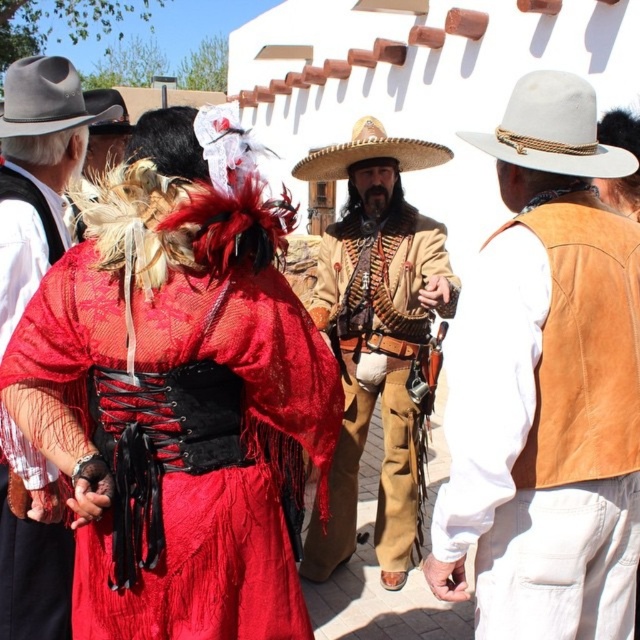
Is brown leather jacket at center above white felt cowboy hat at upper center?

Incorrect, brown leather jacket at center is not positioned above white felt cowboy hat at upper center.

Is brown leather jacket at center behind white felt cowboy hat at upper center?

Yes, it is.

You are a GUI agent. You are given a task and a screenshot of the screen. Output one action in this format:
    pyautogui.click(x=<x>, y=<y>)
    Task: Click on the brown leather jacket at center
    
    Given the screenshot: What is the action you would take?
    pyautogui.click(x=376, y=336)

Is brown leather jacket at center to the left of matte black hat at left from the viewer's perspective?

In fact, brown leather jacket at center is to the right of matte black hat at left.

Consider the image. Is brown leather jacket at center below matte black hat at left?

Indeed, brown leather jacket at center is positioned under matte black hat at left.

Identify the location of brown leather jacket at center. (376, 336).

Image resolution: width=640 pixels, height=640 pixels. I want to click on brown leather jacket at center, so click(x=376, y=336).

Who is more forward, [403,141] or [397,144]?

Positioned in front is point [403,141].

Consider the image. Does brown leather jacket at center appear on the left side of strawmaterial/texturecowboy hat at center?

In fact, brown leather jacket at center is to the right of strawmaterial/texturecowboy hat at center.

This screenshot has height=640, width=640. What do you see at coordinates (376, 336) in the screenshot? I see `brown leather jacket at center` at bounding box center [376, 336].

Identify the location of brown leather jacket at center. (376, 336).